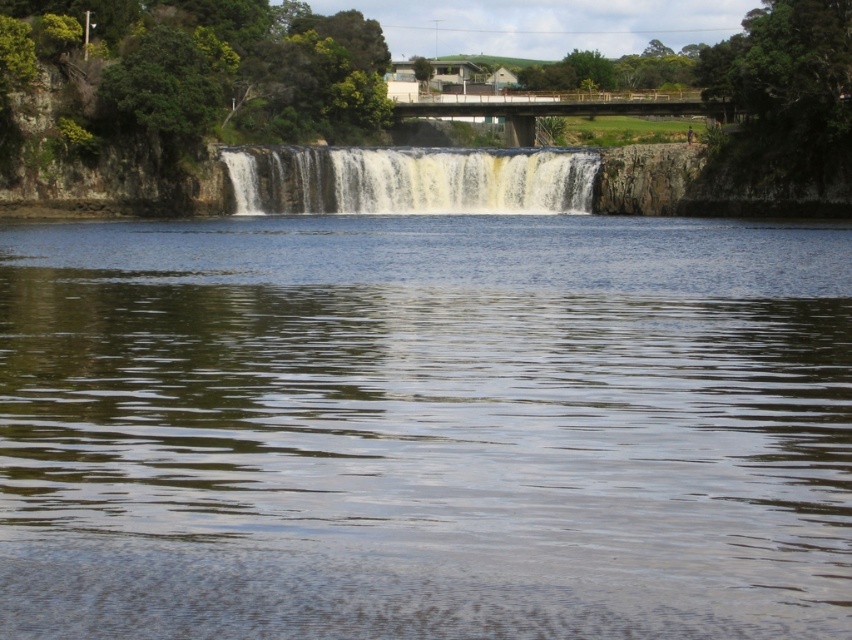
You are standing at the origin point of the coordinate system in this scene. Where is the greenish reflective water at center located in terms of coordinates?

The greenish reflective water at center is located at coordinates point (426, 428).

You are standing at the edge of the waterfall and want to throw a pebble into the greenish reflective water at center and the white frothy water at center. Which one can you reach with a single throw if your maximum throwing distance is 150 feet?

The greenish reflective water at center is 150.83 feet away from white frothy water at center. Since your maximum throwing distance is 150 feet, you cannot reach the greenish reflective water at center but can reach the white frothy water at center.